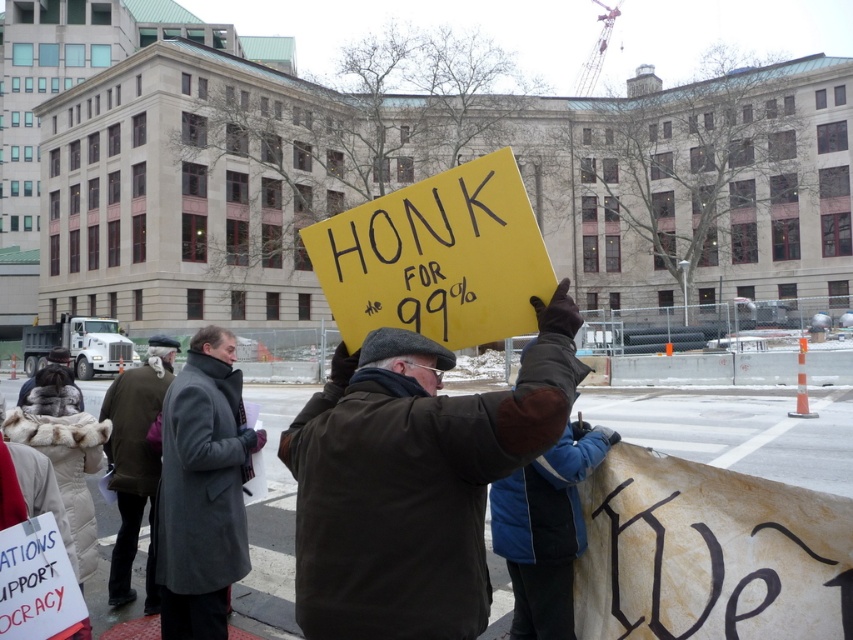
You are a photographer standing at the camera position. You want to take a photo of the protest sign held by the man in the foreground. The sign is located at point (495, 296). You have a camera with a focal length of 50mm. What is the approximate distance in feet between you and the sign?

The distance between the camera and the point (495, 296) is 7.14 feet, so the photographer is approximately 7.14 feet away from the sign.

You are a photographer at the protest. You want to take a photo that includes both the dark brown leather jacket at center and the yellow paper sign at center. Which object should you focus on first to ensure both are in sharp focus?

The dark brown leather jacket at center is closer to the viewer than the yellow paper sign at center. To ensure both are in sharp focus, focus on the dark brown leather jacket at center first, as it is the closer object, and use a small aperture or adjust your focus so that the depth of field includes both objects.

You are a photographer trying to capture a clear shot of both the dark brown leather jacket at center and the dark brown wool coat at center. Since you can only focus on one subject at a time, which one should you focus on to ensure the other is still somewhat in focus?

You should focus on the dark brown leather jacket at center because it is in front of the dark brown wool coat at center. By focusing on the closer object, the background object will still be somewhat in focus, especially if using a smaller aperture.